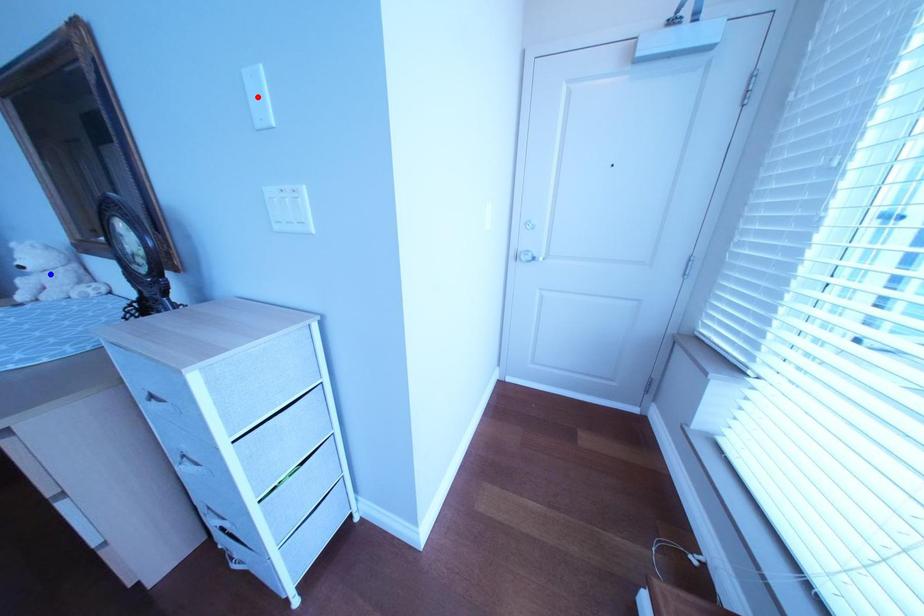
Question: In the image, two points are highlighted. Which point is nearer to the camera? Reply with the corresponding letter.

Choices:
 (A) blue point
 (B) red point

Answer: (B)